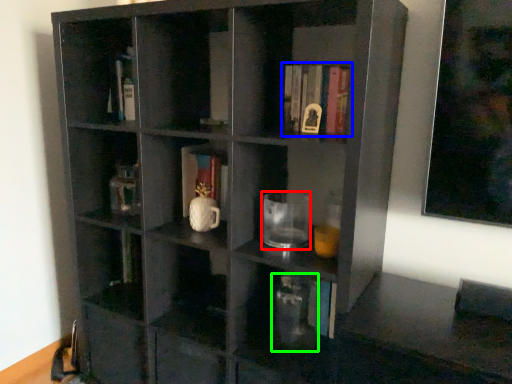
Question: Which is farther away from mug (highlighted by a red box)? book (highlighted by a blue box) or glass vase (highlighted by a green box)?

Choices:
 (A) book
 (B) glass vase

Answer: (A)